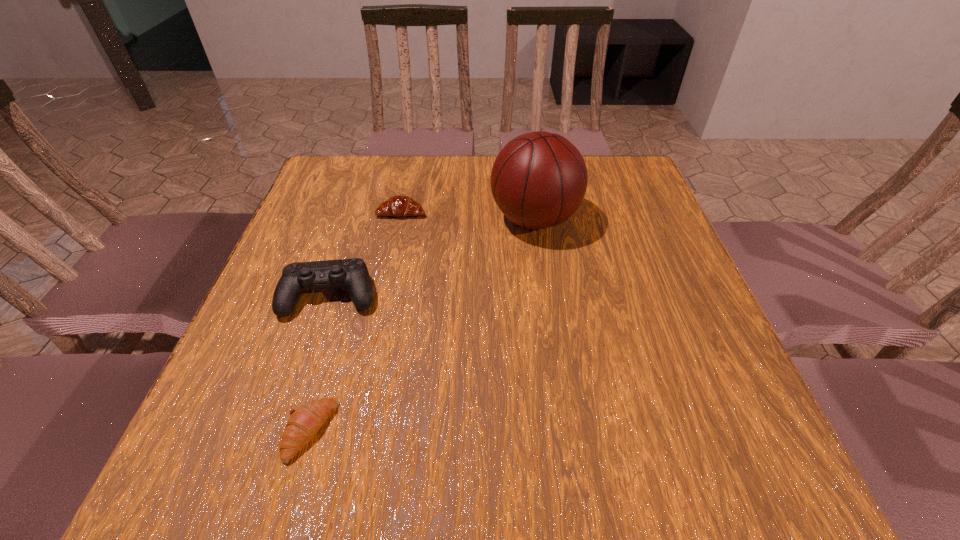
Find the location of a particular element. This screenshot has height=540, width=960. free space located 0.150m on the left of the farther crescent roll is located at coordinates (317, 212).

Locate an element on the screen. The image size is (960, 540). free space located on the back of the shortest object is located at coordinates (354, 275).

Locate an element on the screen. The height and width of the screenshot is (540, 960). object located at the far edge is located at coordinates (538, 180).

Locate an element on the screen. The height and width of the screenshot is (540, 960). object that is at the near edge is located at coordinates (305, 422).

Identify the location of control present at the left edge. This screenshot has height=540, width=960. (353, 274).

Find the location of a particular element. This screenshot has height=540, width=960. crescent roll located in the left edge section of the desktop is located at coordinates (305, 422).

Where is `object positioned at the near left corner`? object positioned at the near left corner is located at coordinates (305, 422).

This screenshot has width=960, height=540. In the image, there is a desktop. Identify the location of vacant space at the far edge. (420, 158).

The width and height of the screenshot is (960, 540). In the image, there is a desktop. Identify the location of vacant space at the near edge. (377, 481).

This screenshot has width=960, height=540. What are the coordinates of `blank space at the left edge` in the screenshot? It's located at (306, 355).